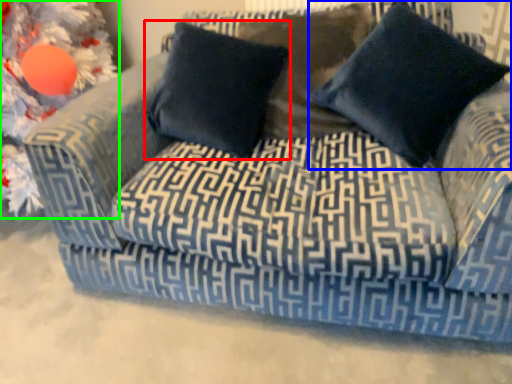
Question: Which object is the farthest from pillow (highlighted by a red box)? Choose among these: pillow (highlighted by a blue box) or christmas decoration (highlighted by a green box).

Choices:
 (A) pillow
 (B) christmas decoration

Answer: (B)